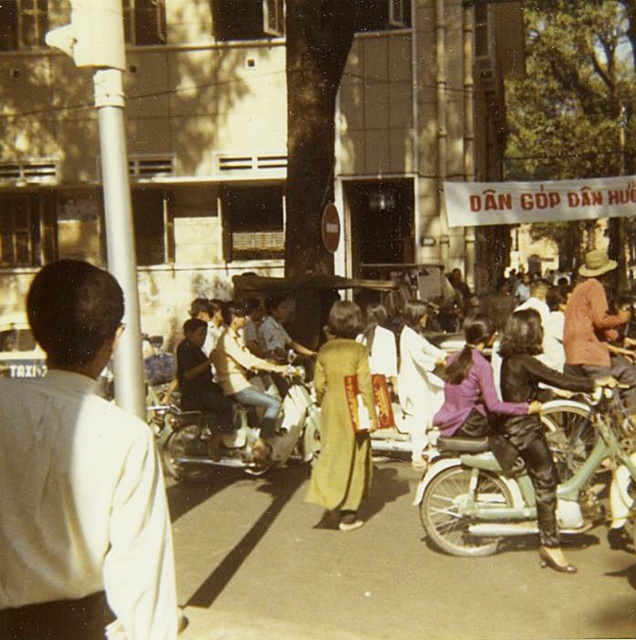
Based on the photo, you are a photographer standing in the middle of the street and see the yellow silk ao dai at center and the leather pants at center. Which one is closer to the top of the image?

The yellow silk ao dai at center is above the leather pants at center, so it is closer to the top of the image.